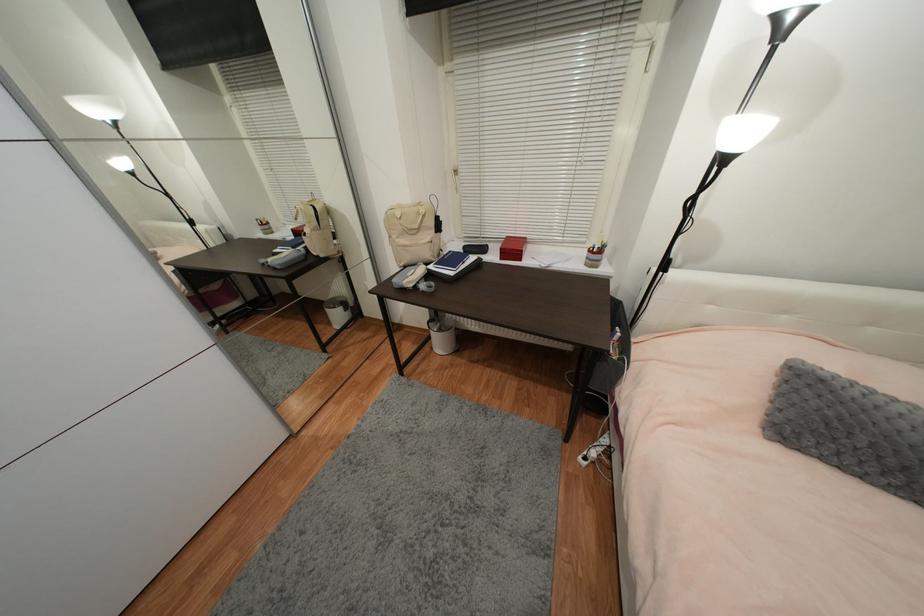
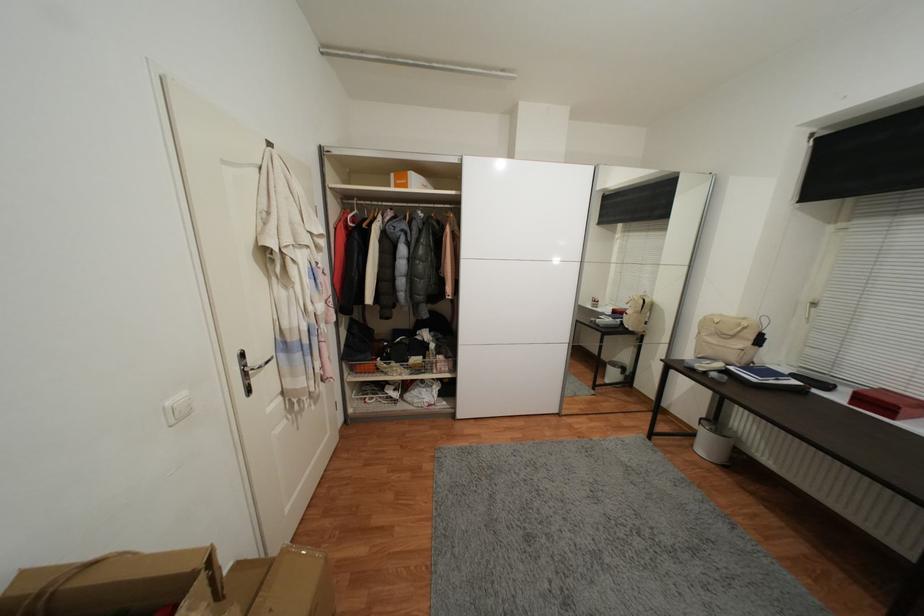
Where in the second image is the point corresponding to [489,251] from the first image?

(831, 387)